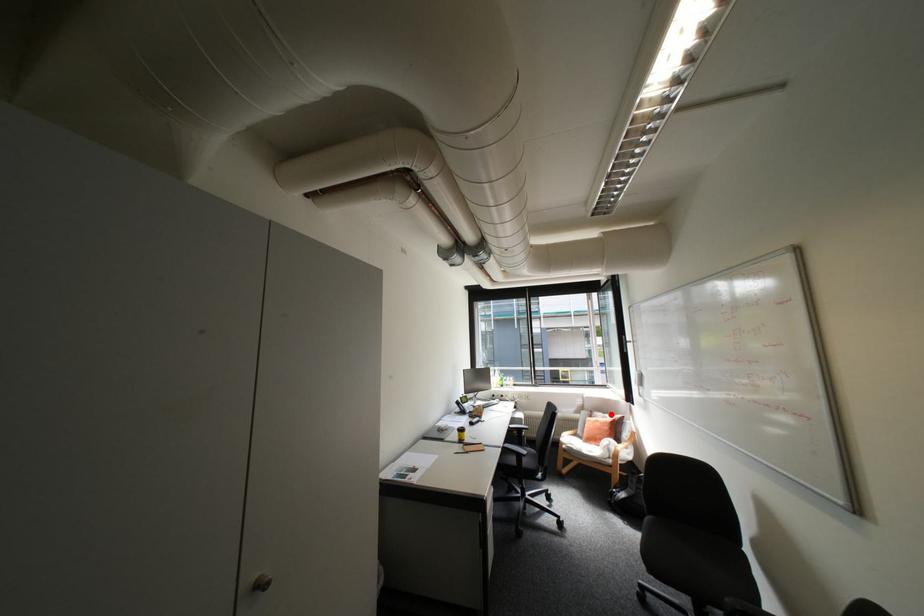
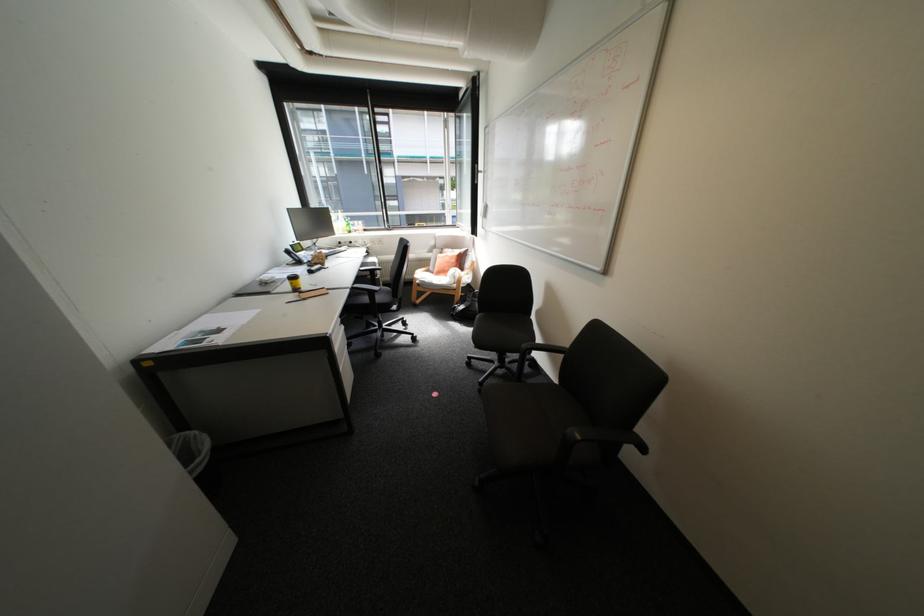
Find the pixel in the second image that matches the highlighted location in the first image.

(459, 249)